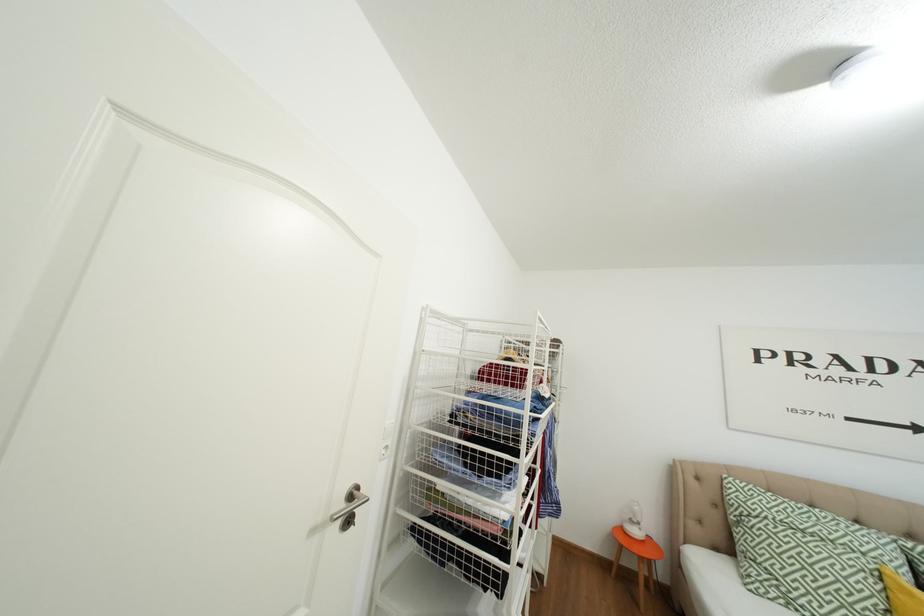
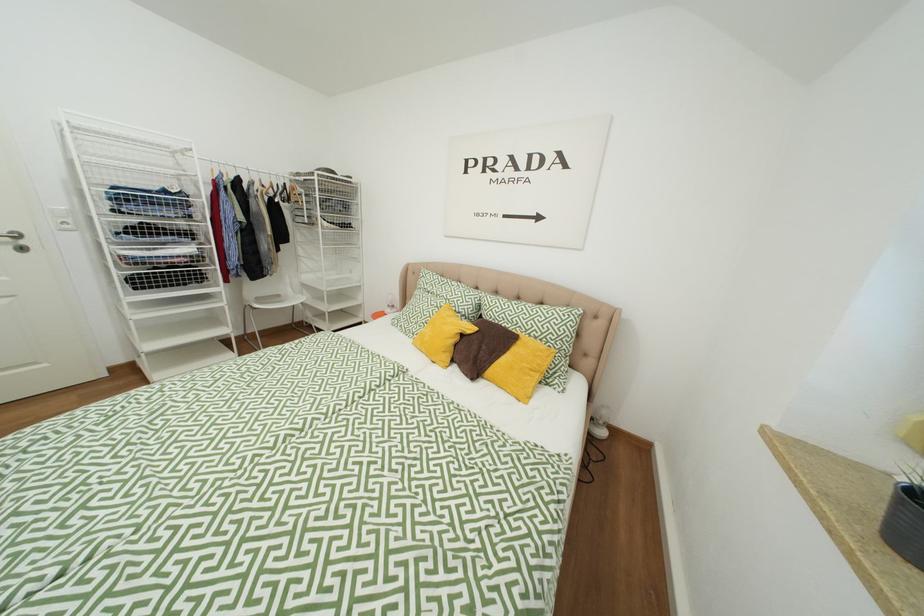
Question: What movement of the cameraman would produce the second image?

Choices:
 (A) Left
 (B) Right
 (C) Forward
 (D) Backward

Answer: (B)